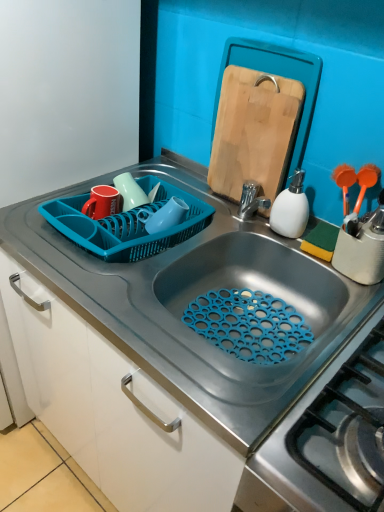
Find the location of a particular element. vacant area that is in front of matte red mug at upper left, acting as the first tableware starting from the left is located at coordinates (82, 256).